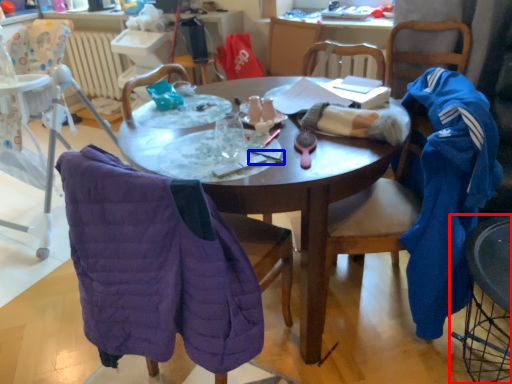
Question: Which point is further to the camera, chair (highlighted by a red box) or pen (highlighted by a blue box)?

Choices:
 (A) chair
 (B) pen

Answer: (B)